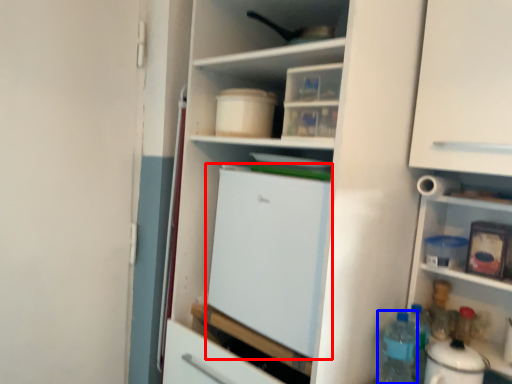
Question: Which object appears farthest to the camera in this image, refrigerator (highlighted by a red box) or bottle (highlighted by a blue box)?

Choices:
 (A) refrigerator
 (B) bottle

Answer: (B)